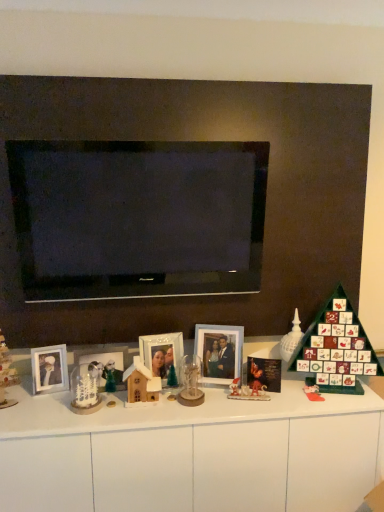
Where is `free space in front of wooden house at center, which appears as the first toy when viewed from the front`? free space in front of wooden house at center, which appears as the first toy when viewed from the front is located at coordinates (134, 416).